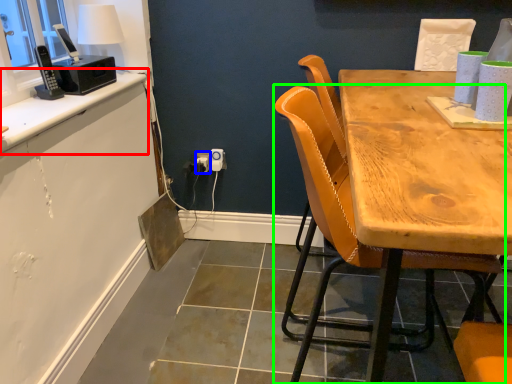
Question: Considering the real-world distances, which object is farthest from counter top (highlighted by a red box)? power outlet (highlighted by a blue box) or chair (highlighted by a green box)?

Choices:
 (A) power outlet
 (B) chair

Answer: (B)